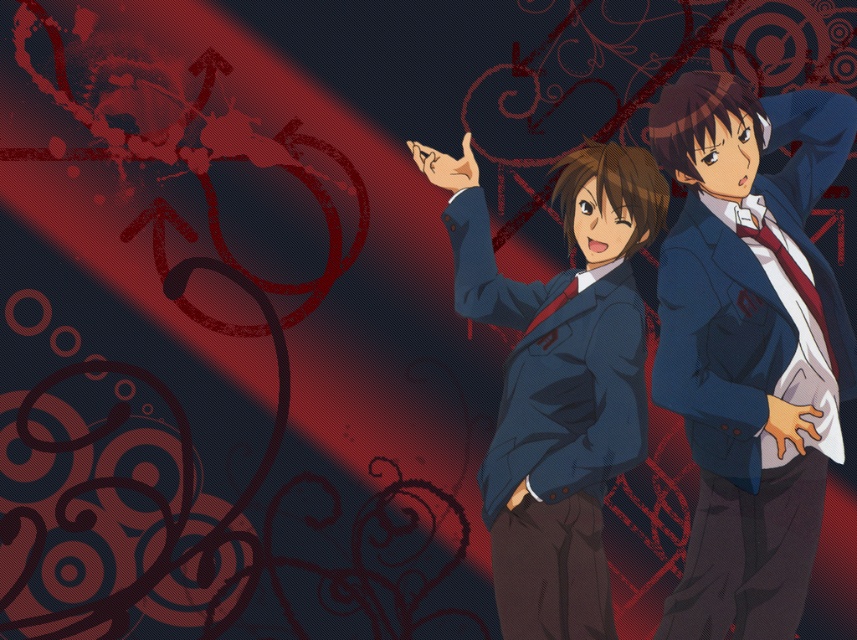
In the scene shown: You are a tailor trying to fit two customers with their respective matte blue blazers. The customer for the matte blue blazer at right is taller than the one for the matte blue blazer at center. Based on the image, will the blazer size match the customer?

The matte blue blazer at right is larger than the matte blue blazer at center. Since the customer for the matte blue blazer at right is taller, the larger size should fit appropriately.

You are an artist trying to draw the scene. The point at coordinates (748, 346) is part of which object in the image?

The point at coordinates (748, 346) corresponds to the matte blue blazer at right.

You are a tailor observing two matte blue blazers in the image. Which one is taller, the matte blue blazer at right or the matte blue blazer at center?

The matte blue blazer at right is much taller than the matte blue blazer at center.